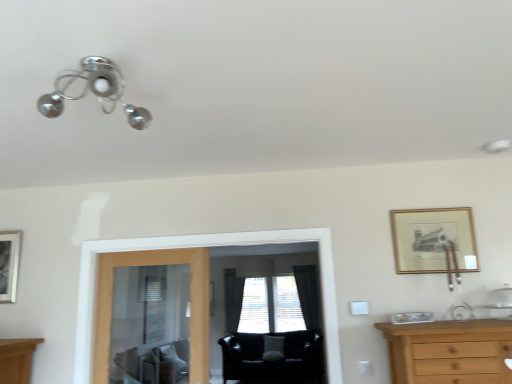
Question: Is there a large distance between black leather swivel chair at center and transparent glass screen door at center?

Choices:
 (A) yes
 (B) no

Answer: (A)

Question: Can you see black leather swivel chair at center touching transparent glass screen door at center?

Choices:
 (A) yes
 (B) no

Answer: (B)

Question: Is the position of black leather swivel chair at center more distant than that of transparent glass screen door at center?

Choices:
 (A) no
 (B) yes

Answer: (B)

Question: Could you tell me if black leather swivel chair at center is facing transparent glass screen door at center?

Choices:
 (A) no
 (B) yes

Answer: (B)

Question: Can you confirm if black leather swivel chair at center is positioned to the left of transparent glass screen door at center?

Choices:
 (A) yes
 (B) no

Answer: (B)

Question: From a real-world perspective, is black leather swivel chair at center beneath transparent glass screen door at center?

Choices:
 (A) no
 (B) yes

Answer: (B)

Question: Can you confirm if clear glass door at center is wider than black fabric curtain at center, which is counted as the second curtain, starting from the right?

Choices:
 (A) no
 (B) yes

Answer: (A)

Question: Considering the relative sizes of clear glass door at center and black fabric curtain at center, which is counted as the 1th curtain, starting from the left, in the image provided, is clear glass door at center bigger than black fabric curtain at center, which is counted as the 1th curtain, starting from the left,?

Choices:
 (A) yes
 (B) no

Answer: (B)

Question: Is clear glass door at center thinner than black fabric curtain at center, which is counted as the second curtain, starting from the right?

Choices:
 (A) no
 (B) yes

Answer: (B)

Question: Does clear glass door at center have a greater height compared to black fabric curtain at center, which is counted as the second curtain, starting from the right?

Choices:
 (A) yes
 (B) no

Answer: (B)

Question: Is clear glass door at center far away from black fabric curtain at center, which is counted as the 1th curtain, starting from the left?

Choices:
 (A) yes
 (B) no

Answer: (A)

Question: Is black fabric curtain at center, which is counted as the second curtain, starting from the right, completely or partially inside clear glass door at center?

Choices:
 (A) yes
 (B) no

Answer: (B)

Question: Does black fabric curtain at center, arranged as the second curtain when viewed from the left, have a lesser height compared to transparent glass screen door at center?

Choices:
 (A) no
 (B) yes

Answer: (A)